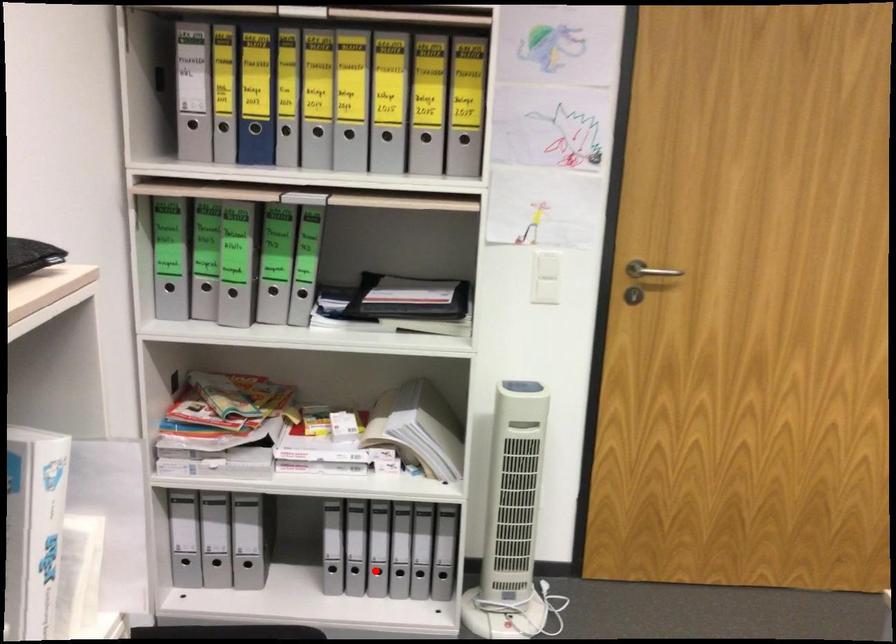
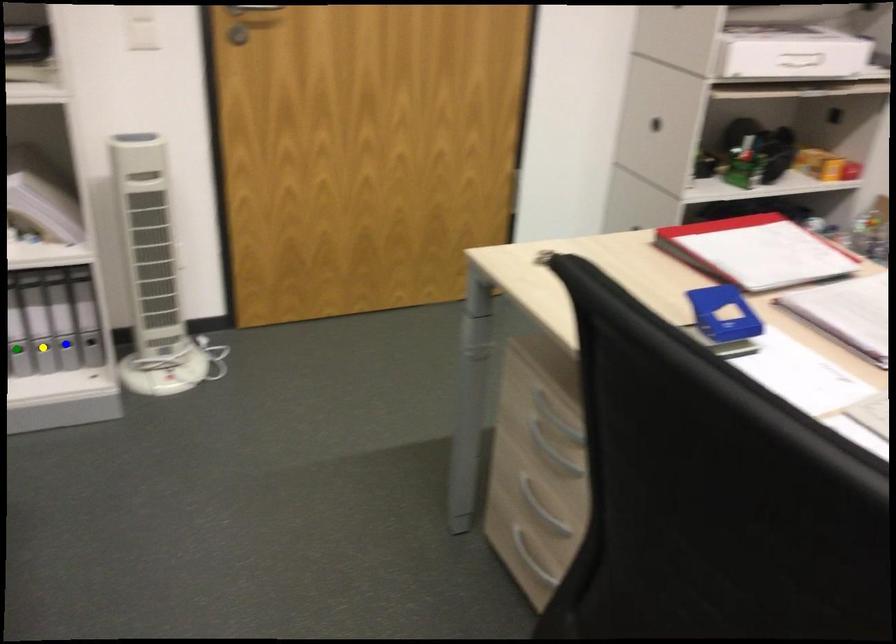
Question: I am providing you with two images of the same scene from different viewpoints. A red point is marked on the first image. You are given multiple points on the second image. In image 2, which mark is for the same physical point as the one in image 1?

Choices:
 (A) blue point
 (B) green point
 (C) yellow point

Answer: (B)